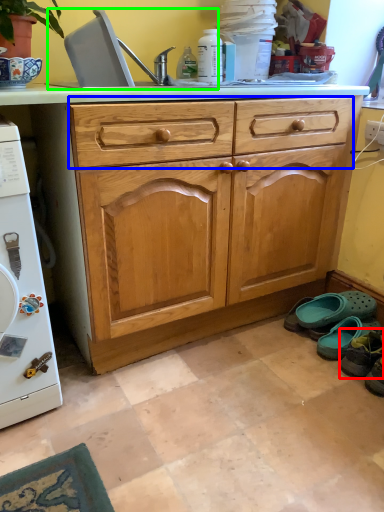
Question: Considering the real-world distances, which object is closest to footwear (highlighted by a red box)? drawer (highlighted by a blue box) or sink (highlighted by a green box).

Choices:
 (A) drawer
 (B) sink

Answer: (A)